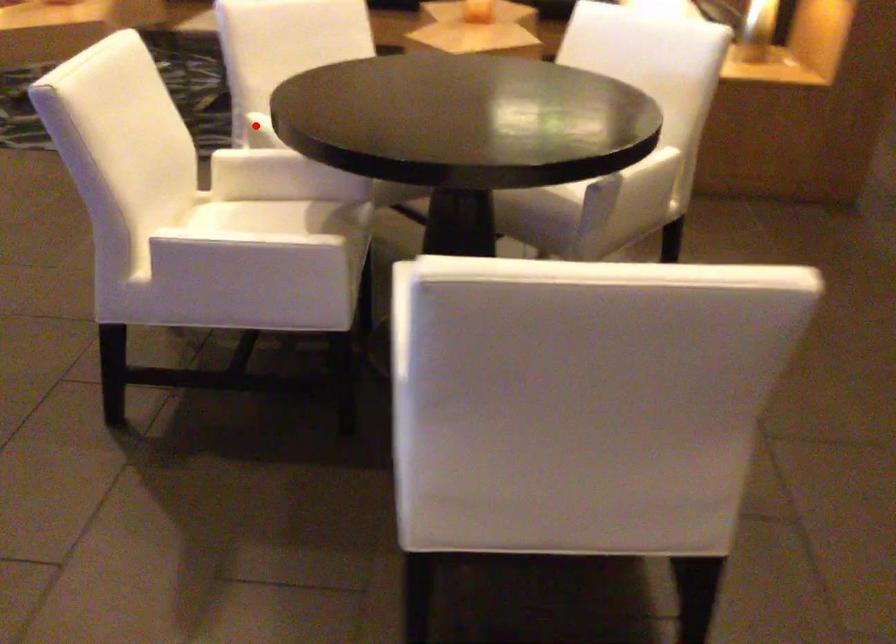
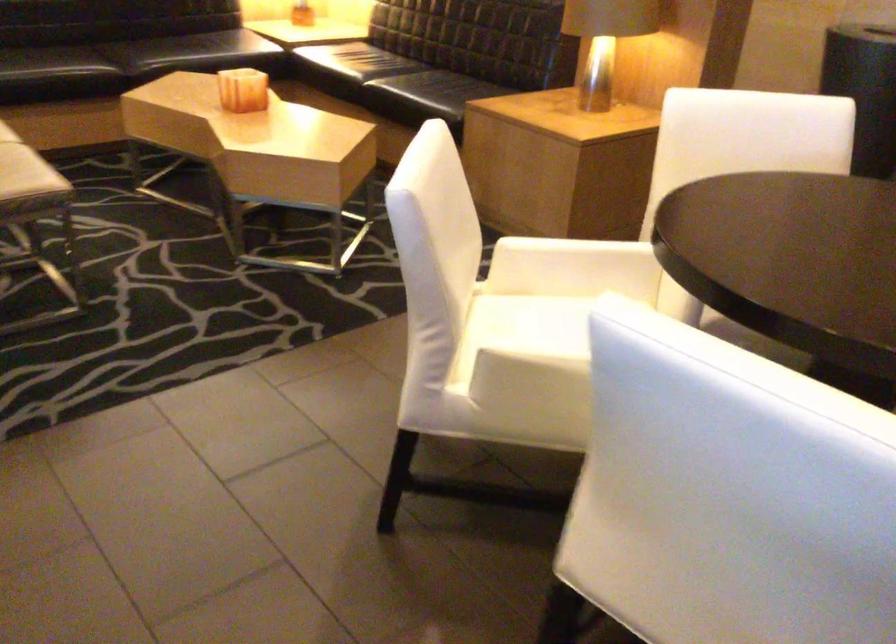
Question: A red point is marked in image1. In image2, is the corresponding 3D point closer to the camera or farther? Reply with the corresponding letter.

Choices:
 (A) The corresponding 3D point is closer.
 (B) The corresponding 3D point is farther.

Answer: (A)